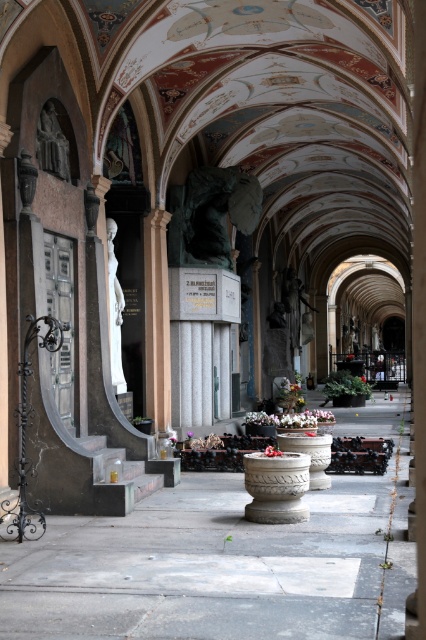
Can you confirm if green bronze statue at center is positioned to the left of matte stone statue at left?

No, green bronze statue at center is not to the left of matte stone statue at left.

In order to click on green bronze statue at center in this screenshot , I will do `click(210, 214)`.

This screenshot has height=640, width=426. I want to click on green bronze statue at center, so click(210, 214).

Which is below, green bronze statue at center or white marble statue at left?

white marble statue at left is below.

Which is in front, point (169, 237) or point (115, 305)?

Positioned in front is point (115, 305).

At what (x,y) coordinates should I click in order to perform the action: click on green bronze statue at center. Please return your answer as a coordinate pair (x, y). Image resolution: width=426 pixels, height=640 pixels. Looking at the image, I should click on (210, 214).

From the picture: Between white marble statue at left and matte stone statue at left, which one is positioned lower?

white marble statue at left

Between white marble statue at left and matte stone statue at left, which one has more height?

white marble statue at left is taller.

In the scene shown: Who is more distant from viewer, (111, 321) or (60, 161)?

The point (111, 321) is behind.

At what (x,y) coordinates should I click in order to perform the action: click on white marble statue at left. Please return your answer as a coordinate pair (x, y). The height and width of the screenshot is (640, 426). Looking at the image, I should click on (115, 310).